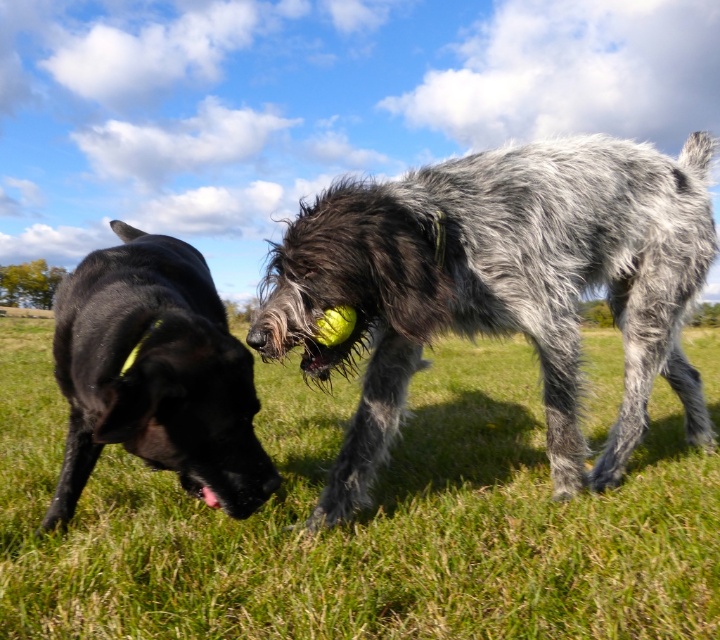
Question: Does green grassy at center appear on the left side of shiny black dog at left?

Choices:
 (A) no
 (B) yes

Answer: (A)

Question: Can you confirm if gray shaggy dog at center is positioned to the right of shiny black dog at left?

Choices:
 (A) yes
 (B) no

Answer: (A)

Question: Which object is farther from the camera taking this photo?

Choices:
 (A) gray shaggy dog at center
 (B) green grassy at center
 (C) shiny black dog at left

Answer: (A)

Question: Which of these objects is positioned closest to the green grassy at center?

Choices:
 (A) shiny black dog at left
 (B) gray shaggy dog at center

Answer: (B)

Question: Which point is farther to the camera?

Choices:
 (A) green grassy at center
 (B) shiny black dog at left
 (C) gray shaggy dog at center

Answer: (C)

Question: Can you confirm if green grassy at center is positioned above gray shaggy dog at center?

Choices:
 (A) no
 (B) yes

Answer: (A)